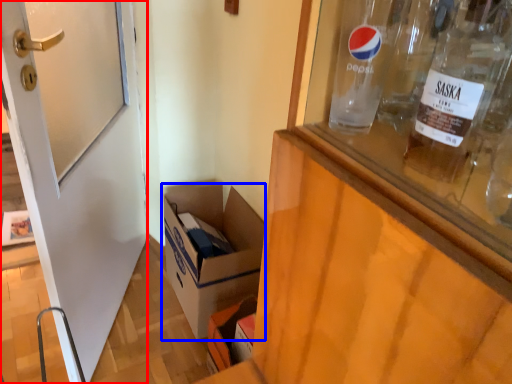
Question: Which point is further to the camera, door (highlighted by a red box) or box (highlighted by a blue box)?

Choices:
 (A) door
 (B) box

Answer: (B)